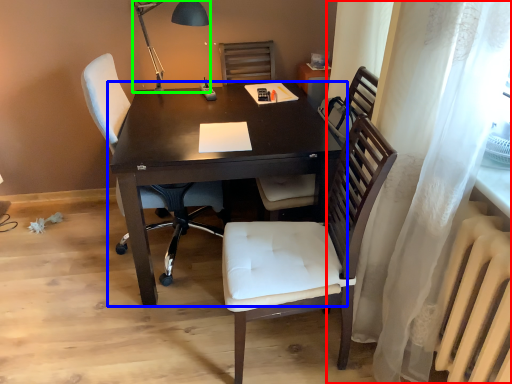
Question: Which is nearer to the curtain (highlighted by a red box)? desk (highlighted by a blue box) or table lamp (highlighted by a green box).

Choices:
 (A) desk
 (B) table lamp

Answer: (A)